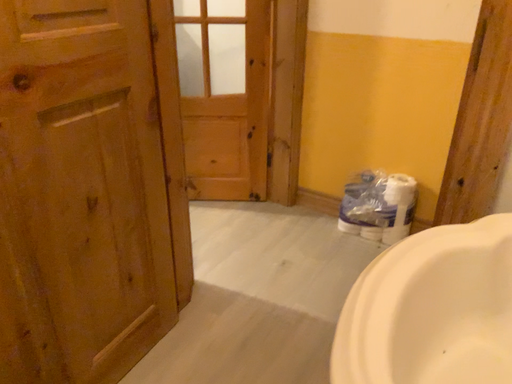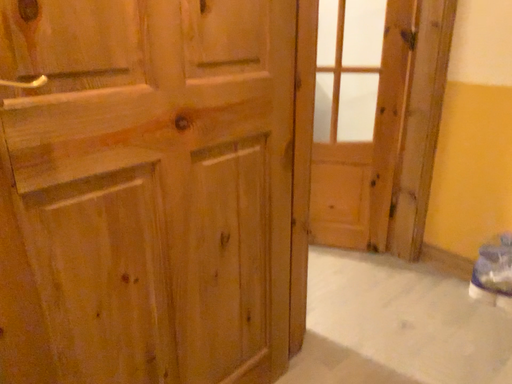
Question: Which way did the camera rotate in the video?

Choices:
 (A) rotated upward
 (B) rotated downward

Answer: (A)